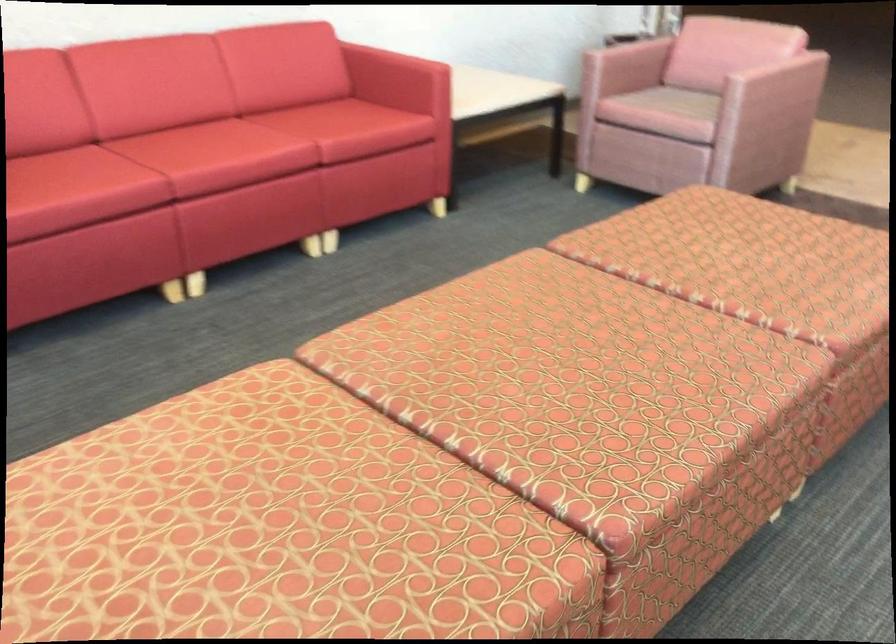
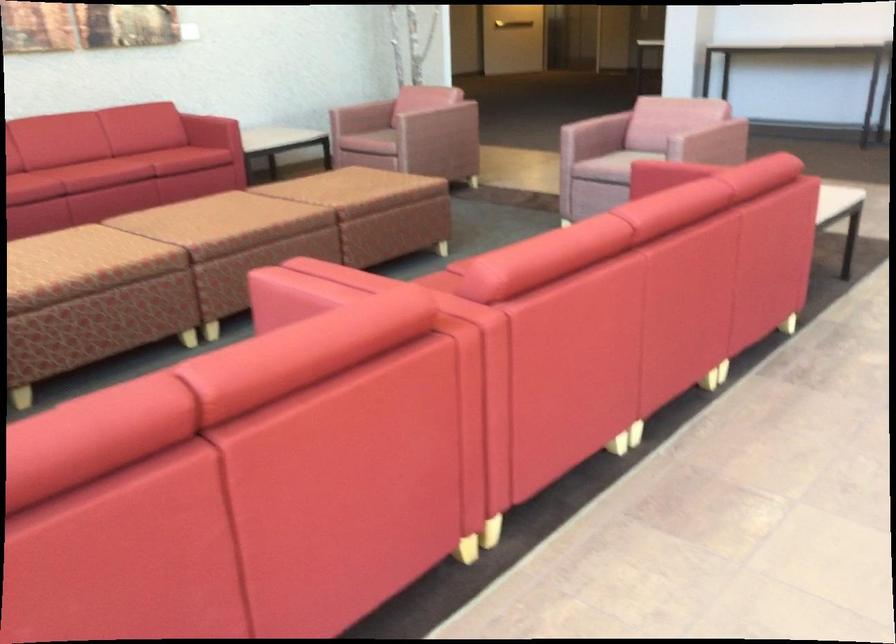
Find the pixel in the second image that matches pixel 712 486 in the first image.

(254, 234)